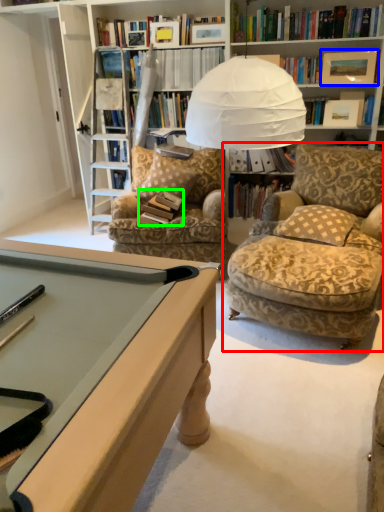
Question: Which object is positioned farthest from chair (highlighted by a red box)? Select from picture frame (highlighted by a blue box) and book (highlighted by a green box).

Choices:
 (A) picture frame
 (B) book

Answer: (A)